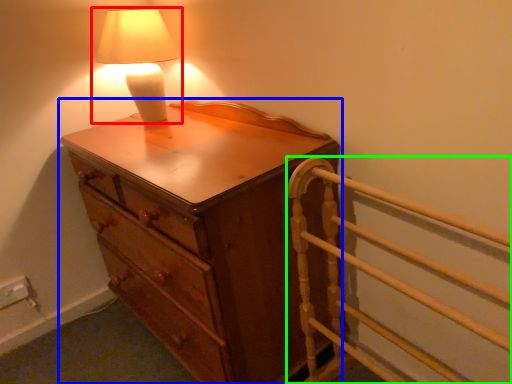
Question: Which is nearer to the lamp (highlighted by a red box)? chest of drawers (highlighted by a blue box) or bed frame (highlighted by a green box).

Choices:
 (A) chest of drawers
 (B) bed frame

Answer: (A)